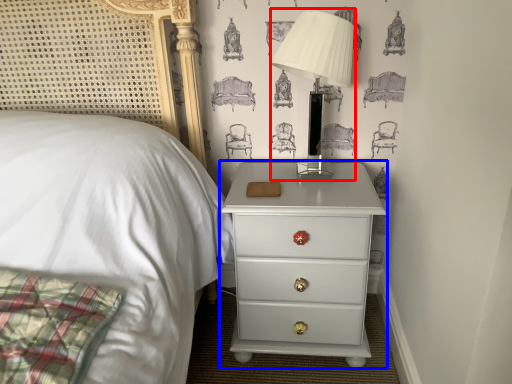
Question: Which point is closer to the camera, table lamp (highlighted by a red box) or nightstand (highlighted by a blue box)?

Choices:
 (A) table lamp
 (B) nightstand

Answer: (A)